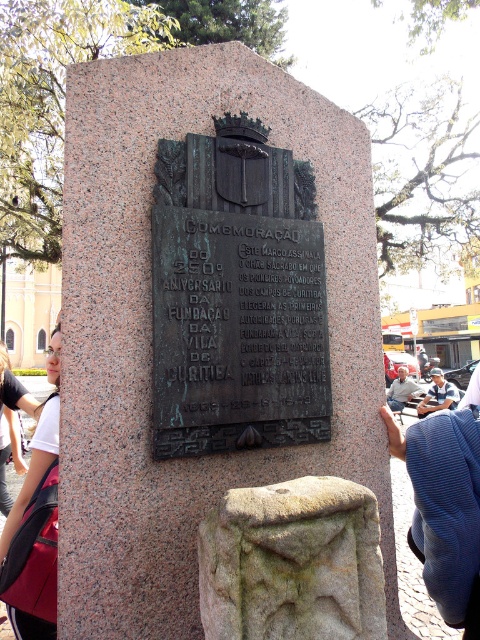
You are a photographer trying to capture a wide shot of the monument. You have a pink fabric backpack at lower left and a blue denim jacket at lower right in your frame. Since you need to remove one item to avoid clutter, which item should you remove to keep the wider object in the photo?

You should remove the pink fabric backpack at lower left because it has a lesser width compared to the blue denim jacket at lower right, so keeping the wider jacket would be better for the composition.